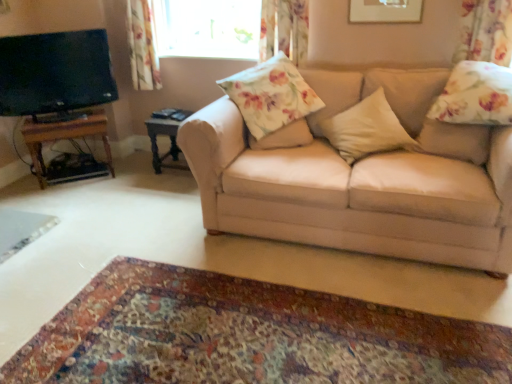
Locate an element on the screen. free spot in front of wooden table at left, which ranks as the 2th table in right-to-left order is located at coordinates (76, 192).